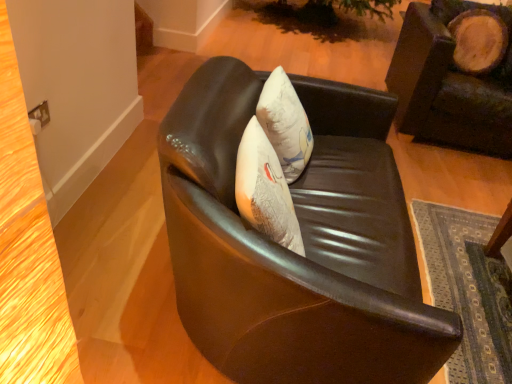
The width and height of the screenshot is (512, 384). What are the coordinates of `shiny black leather chair at center, which is counted as the second chair, starting from the back` in the screenshot? It's located at (304, 243).

This screenshot has width=512, height=384. What do you see at coordinates (304, 243) in the screenshot? I see `shiny black leather chair at center, acting as the first chair starting from the front` at bounding box center [304, 243].

Measure the distance between leather cushion at upper right, which is counted as the second chair, starting from the left, and camera.

leather cushion at upper right, which is counted as the second chair, starting from the left, and camera are 2.40 meters apart from each other.

Measure the distance between point (426,19) and camera.

Point (426,19) and camera are 9.17 feet apart from each other.

Describe the element at coordinates (449, 84) in the screenshot. I see `leather cushion at upper right, which appears as the first chair when viewed from the back` at that location.

I want to click on leather cushion at upper right, arranged as the 2th chair when viewed from the front, so pos(449,84).

Locate an element on the screen. shiny black leather chair at center, the 1th chair in the left-to-right sequence is located at coordinates (304, 243).

Is leather cushion at upper right, which appears as the first chair when viewed from the back, to the left of shiny black leather chair at center, acting as the first chair starting from the front, from the viewer's perspective?

Incorrect, leather cushion at upper right, which appears as the first chair when viewed from the back, is not on the left side of shiny black leather chair at center, acting as the first chair starting from the front.

Between leather cushion at upper right, arranged as the 2th chair when viewed from the front, and shiny black leather chair at center, the second chair when ordered from right to left, which one is positioned in front?

shiny black leather chair at center, the second chair when ordered from right to left, is closer to the camera.

Which is nearer, [486,129] or [336,225]?

Point [336,225]

From the image's perspective, between leather cushion at upper right, which appears as the first chair when viewed from the back, and shiny black leather chair at center, the 1th chair in the left-to-right sequence, which one is located above?

From the image's view, leather cushion at upper right, which appears as the first chair when viewed from the back, is above.

From a real-world perspective, between leather cushion at upper right, which appears as the first chair when viewed from the back, and shiny black leather chair at center, acting as the first chair starting from the front, who is vertically higher?

leather cushion at upper right, which appears as the first chair when viewed from the back, is physically above.

Is leather cushion at upper right, which appears as the first chair when viewed from the back, wider than shiny black leather chair at center, acting as the first chair starting from the front?

Indeed, leather cushion at upper right, which appears as the first chair when viewed from the back, has a greater width compared to shiny black leather chair at center, acting as the first chair starting from the front.

Which of these two, leather cushion at upper right, arranged as the 2th chair when viewed from the front, or shiny black leather chair at center, which is counted as the second chair, starting from the back, stands taller?

With more height is leather cushion at upper right, arranged as the 2th chair when viewed from the front.

Which of these two, leather cushion at upper right, arranged as the 2th chair when viewed from the front, or shiny black leather chair at center, acting as the first chair starting from the front, is bigger?

shiny black leather chair at center, acting as the first chair starting from the front.

Is leather cushion at upper right, which appears as the first chair when viewed from the back, not inside shiny black leather chair at center, which is counted as the second chair, starting from the back?

Yes.

Is leather cushion at upper right, which is counted as the second chair, starting from the left, placed right next to shiny black leather chair at center, the 1th chair in the left-to-right sequence?

leather cushion at upper right, which is counted as the second chair, starting from the left, and shiny black leather chair at center, the 1th chair in the left-to-right sequence, are not in contact.

Is leather cushion at upper right, which appears as the first chair when viewed from the back, oriented away from shiny black leather chair at center, the 1th chair in the left-to-right sequence?

That's not correct — leather cushion at upper right, which appears as the first chair when viewed from the back, is not looking away from shiny black leather chair at center, the 1th chair in the left-to-right sequence.

In the scene shown: How far apart are leather cushion at upper right, which is counted as the second chair, starting from the left, and shiny black leather chair at center, which is counted as the second chair, starting from the back?

A distance of 1.32 meters exists between leather cushion at upper right, which is counted as the second chair, starting from the left, and shiny black leather chair at center, which is counted as the second chair, starting from the back.

Locate an element on the screen. This screenshot has width=512, height=384. chair that is on the left side of leather cushion at upper right, which appears as the first chair when viewed from the back is located at coordinates (304, 243).

Which object is positioned more to the right, shiny black leather chair at center, the second chair when ordered from right to left, or leather cushion at upper right, which appears as the first chair when viewed from the back?

Positioned to the right is leather cushion at upper right, which appears as the first chair when viewed from the back.

Is the depth of shiny black leather chair at center, acting as the first chair starting from the front, greater than that of leather cushion at upper right, which appears as the first chair when viewed from the back?

No, it is not.

Which is more distant, (227, 323) or (419, 9)?

The point (419, 9) is farther.

From the image's perspective, is shiny black leather chair at center, which is counted as the second chair, starting from the back, above or below leather cushion at upper right, arranged as the 2th chair when viewed from the front?

From the image's perspective, shiny black leather chair at center, which is counted as the second chair, starting from the back, appears below leather cushion at upper right, arranged as the 2th chair when viewed from the front.

From a real-world perspective, is shiny black leather chair at center, acting as the first chair starting from the front, physically located above or below leather cushion at upper right, which is the first chair in right-to-left order?

In terms of real-world spatial position, shiny black leather chair at center, acting as the first chair starting from the front, is below leather cushion at upper right, which is the first chair in right-to-left order.

Considering the relative sizes of shiny black leather chair at center, which is counted as the second chair, starting from the back, and leather cushion at upper right, which is counted as the second chair, starting from the left, in the image provided, is shiny black leather chair at center, which is counted as the second chair, starting from the back, wider than leather cushion at upper right, which is counted as the second chair, starting from the left,?

Incorrect, the width of shiny black leather chair at center, which is counted as the second chair, starting from the back, does not surpass that of leather cushion at upper right, which is counted as the second chair, starting from the left.

Can you confirm if shiny black leather chair at center, which is counted as the second chair, starting from the back, is taller than leather cushion at upper right, which is counted as the second chair, starting from the left?

No.

Between shiny black leather chair at center, which is counted as the second chair, starting from the back, and leather cushion at upper right, which appears as the first chair when viewed from the back, which one has larger size?

shiny black leather chair at center, which is counted as the second chair, starting from the back, is bigger.

In the scene shown: Would you say shiny black leather chair at center, acting as the first chair starting from the front, is inside or outside leather cushion at upper right, arranged as the 2th chair when viewed from the front?

The correct answer is: outside.

Is shiny black leather chair at center, the 1th chair in the left-to-right sequence, not near leather cushion at upper right, arranged as the 2th chair when viewed from the front?

That's right, there is a large distance between shiny black leather chair at center, the 1th chair in the left-to-right sequence, and leather cushion at upper right, arranged as the 2th chair when viewed from the front.

Is leather cushion at upper right, arranged as the 2th chair when viewed from the front, at the back of shiny black leather chair at center, the second chair when ordered from right to left?

No, shiny black leather chair at center, the second chair when ordered from right to left,'s orientation is not away from leather cushion at upper right, arranged as the 2th chair when viewed from the front.

How many degrees apart are the facing directions of shiny black leather chair at center, the second chair when ordered from right to left, and leather cushion at upper right, which is counted as the second chair, starting from the left?

The angular difference between shiny black leather chair at center, the second chair when ordered from right to left, and leather cushion at upper right, which is counted as the second chair, starting from the left, is 89.1 degrees.

How much distance is there between shiny black leather chair at center, which is counted as the second chair, starting from the back, and leather cushion at upper right, which is counted as the second chair, starting from the left?

shiny black leather chair at center, which is counted as the second chair, starting from the back, and leather cushion at upper right, which is counted as the second chair, starting from the left, are 1.32 meters apart from each other.

You are a GUI agent. You are given a task and a screenshot of the screen. Output one action in this format:
    pyautogui.click(x=<x>, y=<y>)
    Task: Click on the chair above the shiny black leather chair at center, acting as the first chair starting from the front (from the image's perspective)
    The height and width of the screenshot is (384, 512).
    Given the screenshot: What is the action you would take?
    pyautogui.click(x=449, y=84)

Where is `chair below the leather cushion at upper right, which is the first chair in right-to-left order (from the image's perspective)`? The image size is (512, 384). chair below the leather cushion at upper right, which is the first chair in right-to-left order (from the image's perspective) is located at coordinates (304, 243).

Locate an element on the screen. This screenshot has width=512, height=384. chair directly beneath the leather cushion at upper right, which is counted as the second chair, starting from the left (from a real-world perspective) is located at coordinates (304, 243).